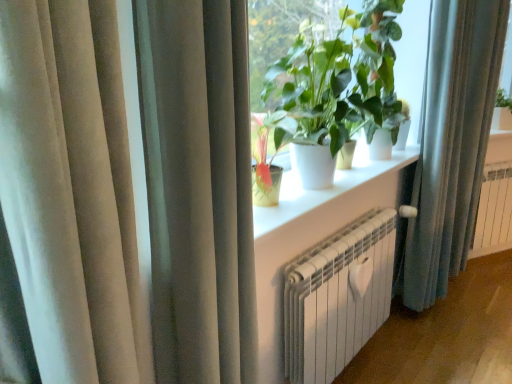
Question: Can you confirm if green matte plant at upper center is smaller than blue fabric curtain at right, arranged as the 2th curtain when viewed from the front?

Choices:
 (A) no
 (B) yes

Answer: (A)

Question: From the image's perspective, is green matte plant at upper center on blue fabric curtain at right, which is counted as the first curtain, starting from the right?

Choices:
 (A) no
 (B) yes

Answer: (B)

Question: Is green matte plant at upper center outside blue fabric curtain at right, positioned as the second curtain in left-to-right order?

Choices:
 (A) no
 (B) yes

Answer: (B)

Question: Does green matte plant at upper center come behind blue fabric curtain at right, positioned as the second curtain in left-to-right order?

Choices:
 (A) yes
 (B) no

Answer: (B)

Question: Could blue fabric curtain at right, arranged as the 2th curtain when viewed from the front, be considered to be inside green matte plant at upper center?

Choices:
 (A) yes
 (B) no

Answer: (B)

Question: Can you confirm if green matte plant at upper center is positioned to the left of blue fabric curtain at right, placed as the first curtain when sorted from back to front?

Choices:
 (A) no
 (B) yes

Answer: (B)

Question: Considering the relative sizes of satin beige curtain at left, the 1th curtain when ordered from left to right, and blue fabric curtain at right, arranged as the 2th curtain when viewed from the front, in the image provided, is satin beige curtain at left, the 1th curtain when ordered from left to right, thinner than blue fabric curtain at right, arranged as the 2th curtain when viewed from the front,?

Choices:
 (A) no
 (B) yes

Answer: (A)

Question: Is satin beige curtain at left, the 1th curtain when ordered from left to right, taller than blue fabric curtain at right, placed as the first curtain when sorted from back to front?

Choices:
 (A) no
 (B) yes

Answer: (A)

Question: From a real-world perspective, is satin beige curtain at left, marked as the second curtain in a back-to-front arrangement, located beneath blue fabric curtain at right, placed as the first curtain when sorted from back to front?

Choices:
 (A) yes
 (B) no

Answer: (B)

Question: Is blue fabric curtain at right, placed as the first curtain when sorted from back to front, located within satin beige curtain at left, marked as the second curtain in a back-to-front arrangement?

Choices:
 (A) yes
 (B) no

Answer: (B)

Question: Is satin beige curtain at left, the first curtain when ordered from front to back, at the right side of blue fabric curtain at right, placed as the first curtain when sorted from back to front?

Choices:
 (A) yes
 (B) no

Answer: (B)

Question: Is satin beige curtain at left, the first curtain when ordered from front to back, positioned far away from blue fabric curtain at right, positioned as the second curtain in left-to-right order?

Choices:
 (A) yes
 (B) no

Answer: (A)

Question: Is green matte plant at upper center further to the viewer compared to white metallic radiator at lower center?

Choices:
 (A) yes
 (B) no

Answer: (B)